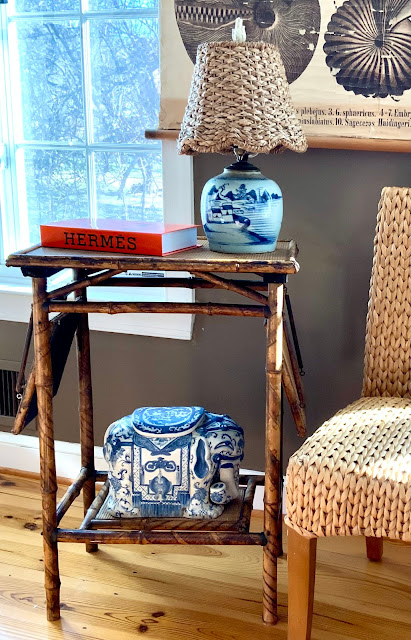
This screenshot has width=411, height=640. Identify the location of window frame. (176, 187).